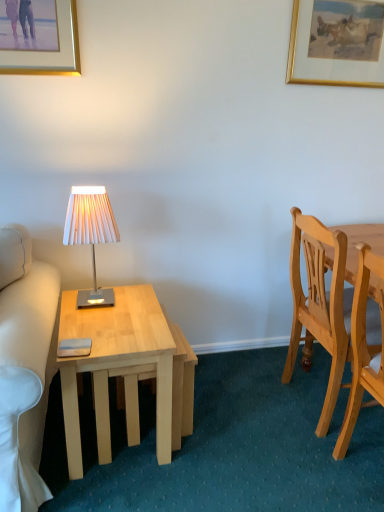
Question: Is white pleated fabric lampshade at left positioned beyond the bounds of light wood chair at right, arranged as the first chair when viewed from the back?

Choices:
 (A) yes
 (B) no

Answer: (A)

Question: Is white pleated fabric lampshade at left closer to the viewer compared to light wood chair at right, the second chair positioned from the front?

Choices:
 (A) no
 (B) yes

Answer: (A)

Question: Is white pleated fabric lampshade at left facing towards light wood chair at right, the second chair positioned from the front?

Choices:
 (A) yes
 (B) no

Answer: (B)

Question: Is white pleated fabric lampshade at left next to light wood chair at right, the second chair positioned from the front, and touching it?

Choices:
 (A) yes
 (B) no

Answer: (B)

Question: From a real-world perspective, is white pleated fabric lampshade at left under light wood chair at right, the second chair positioned from the front?

Choices:
 (A) no
 (B) yes

Answer: (A)

Question: Does white pleated fabric lampshade at left have a larger size compared to light wood chair at right, the second chair positioned from the front?

Choices:
 (A) yes
 (B) no

Answer: (B)

Question: Considering the relative sizes of white pleated fabric lampshade at left and gold-framed picture at upper left, which is the 1th picture frame in left-to-right order, in the image provided, is white pleated fabric lampshade at left shorter than gold-framed picture at upper left, which is the 1th picture frame in left-to-right order,?

Choices:
 (A) yes
 (B) no

Answer: (B)

Question: Is white pleated fabric lampshade at left not within gold-framed picture at upper left, which is the 1th picture frame in left-to-right order?

Choices:
 (A) no
 (B) yes

Answer: (B)

Question: From the image's perspective, is white pleated fabric lampshade at left on gold-framed picture at upper left, which ranks as the 2th picture frame in right-to-left order?

Choices:
 (A) no
 (B) yes

Answer: (A)

Question: Is white pleated fabric lampshade at left oriented towards gold-framed picture at upper left, which is the 1th picture frame in left-to-right order?

Choices:
 (A) no
 (B) yes

Answer: (A)

Question: Does white pleated fabric lampshade at left have a greater height compared to gold-framed picture at upper left, which ranks as the 2th picture frame in right-to-left order?

Choices:
 (A) no
 (B) yes

Answer: (B)

Question: Is the position of white pleated fabric lampshade at left more distant than that of gold-framed picture at upper left, which is the 2th picture frame from back to front?

Choices:
 (A) yes
 (B) no

Answer: (B)

Question: Is light wood chair at right, arranged as the first chair when viewed from the back, facing away from light wood desk at left?

Choices:
 (A) yes
 (B) no

Answer: (A)